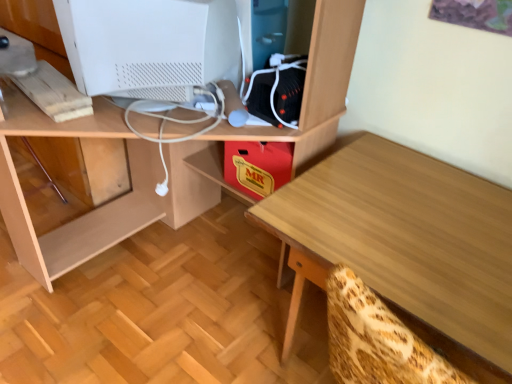
Question: Considering the relative sizes of light wood table at center and white matte computer monitor at upper left in the image provided, is light wood table at center wider than white matte computer monitor at upper left?

Choices:
 (A) no
 (B) yes

Answer: (B)

Question: Are light wood table at center and white matte computer monitor at upper left beside each other?

Choices:
 (A) no
 (B) yes

Answer: (A)

Question: Is light wood table at center thinner than white matte computer monitor at upper left?

Choices:
 (A) yes
 (B) no

Answer: (B)

Question: Is light wood table at center to the right of white matte computer monitor at upper left from the viewer's perspective?

Choices:
 (A) yes
 (B) no

Answer: (A)

Question: Is the depth of light wood table at center greater than that of white matte computer monitor at upper left?

Choices:
 (A) yes
 (B) no

Answer: (B)

Question: Could you tell me if light wood table at center is facing white matte computer monitor at upper left?

Choices:
 (A) no
 (B) yes

Answer: (A)

Question: Is white matte computer monitor at upper left facing away from light wood table at center?

Choices:
 (A) no
 (B) yes

Answer: (A)

Question: Can we say white matte computer monitor at upper left lies outside light wood table at center?

Choices:
 (A) no
 (B) yes

Answer: (B)

Question: From the image's perspective, does white matte computer monitor at upper left appear lower than light wood table at center?

Choices:
 (A) no
 (B) yes

Answer: (A)

Question: From a real-world perspective, does white matte computer monitor at upper left sit lower than light wood table at center?

Choices:
 (A) no
 (B) yes

Answer: (A)

Question: Does white matte computer monitor at upper left have a larger size compared to light wood table at center?

Choices:
 (A) no
 (B) yes

Answer: (A)

Question: Is white matte computer monitor at upper left far away from light wood table at center?

Choices:
 (A) no
 (B) yes

Answer: (A)

Question: From a real-world perspective, is white matte computer monitor at upper left physically above wooden desk at center?

Choices:
 (A) no
 (B) yes

Answer: (B)